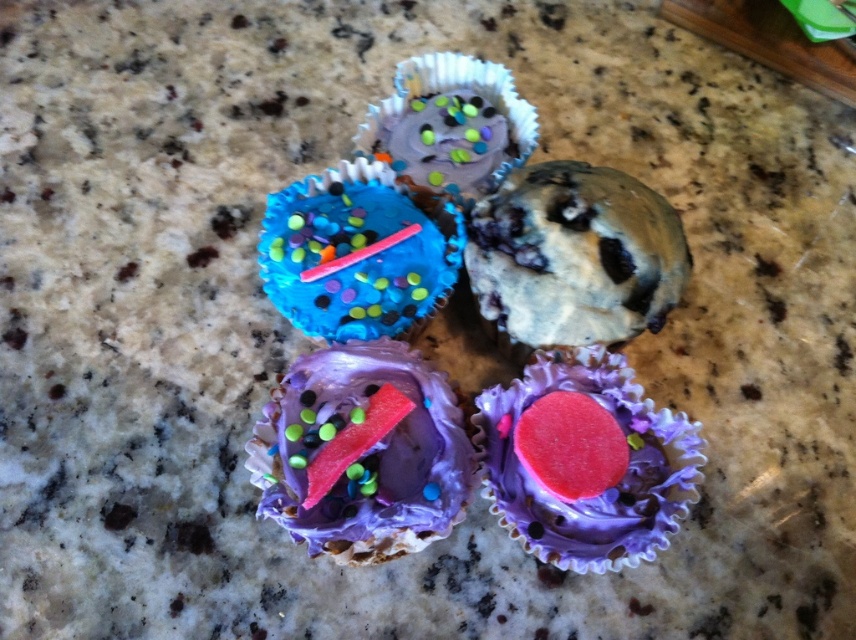
Question: Which object is farther from the camera taking this photo?

Choices:
 (A) purple glossy cupcake at center
 (B) blue glossy cupcake at center-left

Answer: (B)

Question: Which point is farther from the camera taking this photo?

Choices:
 (A) (426, 227)
 (B) (500, 420)
 (C) (495, 129)
 (D) (621, 429)

Answer: (C)

Question: Can you confirm if purple frosted muffin at center is bigger than purple frosted cupcake with sprinkles and candy at center?

Choices:
 (A) yes
 (B) no

Answer: (A)

Question: Can you confirm if purple frosted muffin at center is positioned to the right of purple glossy cupcake at center?

Choices:
 (A) yes
 (B) no

Answer: (B)

Question: Which object appears closest to the camera in this image?

Choices:
 (A) purple frosted cupcake with sprinkles and candy at center
 (B) purple frosted muffin at center
 (C) purple glossy cupcake at center
 (D) purple frosted cupcake with sprinkles at upper center

Answer: (A)

Question: Can you confirm if blue glossy cupcake at center-left is positioned to the right of purple frosted cupcake with sprinkles at upper center?

Choices:
 (A) no
 (B) yes

Answer: (A)